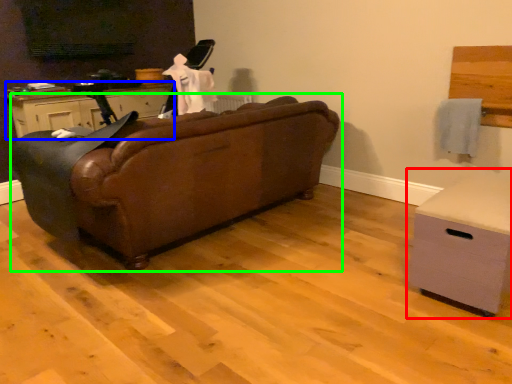
Question: Which object is the closest to the chest of drawers (highlighted by a red box)? Choose among these: cabinetry (highlighted by a blue box) or studio couch (highlighted by a green box).

Choices:
 (A) cabinetry
 (B) studio couch

Answer: (B)